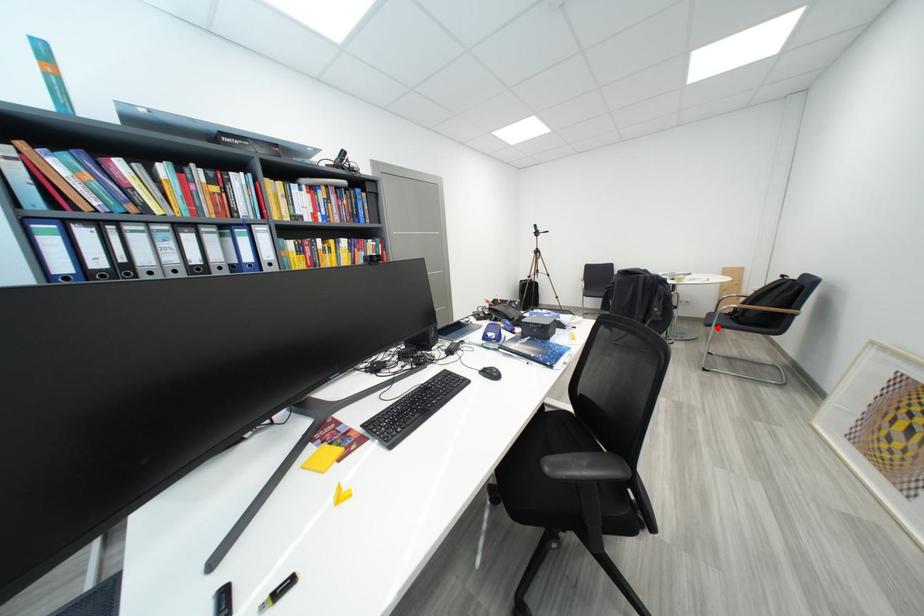
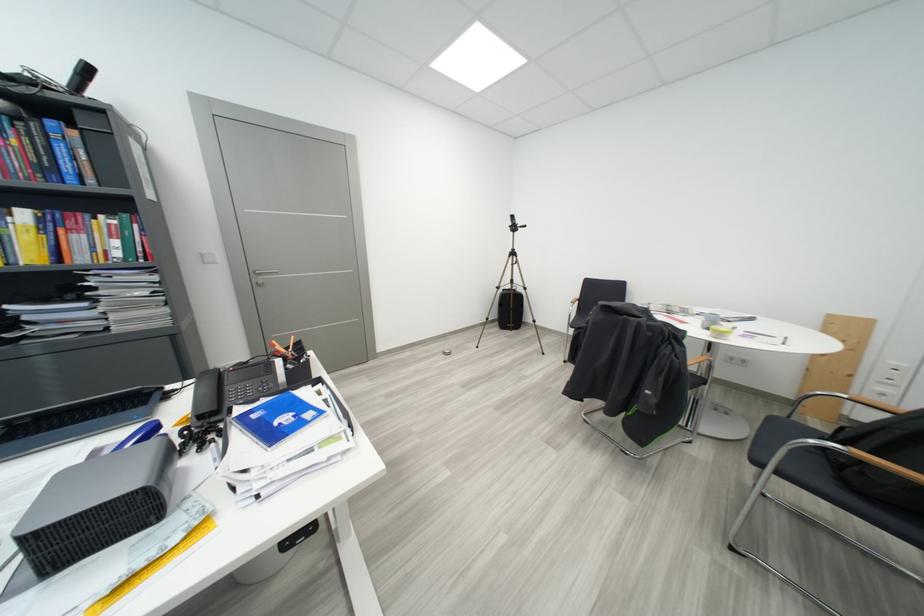
Locate, in the second image, the point that corresponds to the highlighted location in the first image.

(767, 466)